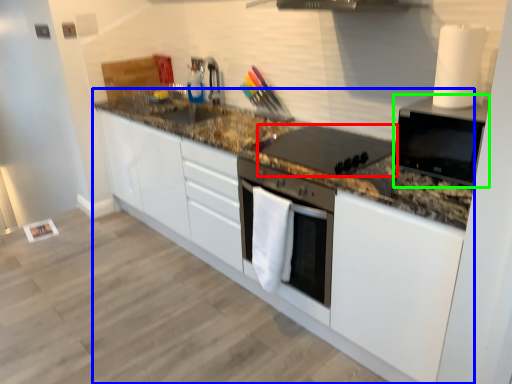
Question: Which is nearer to the kitchen appliance (highlighted by a red box)? countertop (highlighted by a blue box) or home appliance (highlighted by a green box).

Choices:
 (A) countertop
 (B) home appliance

Answer: (A)